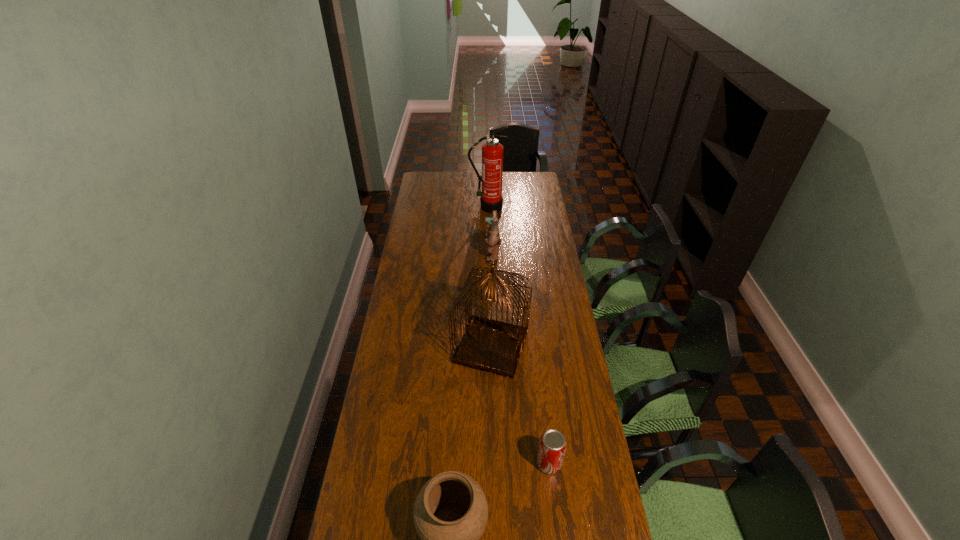
Locate an element on the screen. The image size is (960, 540). fire extinguisher is located at coordinates (491, 199).

Locate an element on the screen. birdcage is located at coordinates (493, 346).

Where is `the fourth nearest object`? This screenshot has height=540, width=960. the fourth nearest object is located at coordinates (493, 242).

Locate an element on the screen. The image size is (960, 540). figurine is located at coordinates pyautogui.click(x=493, y=242).

Identify the location of the second nearest object. (552, 446).

Find the location of `soda can`. soda can is located at coordinates (552, 446).

Identify the location of free region located 0.380m on the front-facing side of the fire extinguisher. (489, 259).

Locate an element on the screen. vacant region located on the left of the birdcage is located at coordinates (419, 347).

At what (x,y) coordinates should I click in order to perform the action: click on vacant space situated 0.180m on the front-facing side of the figurine. Please return your answer as a coordinate pair (x, y). This screenshot has height=540, width=960. Looking at the image, I should click on (446, 256).

At what (x,y) coordinates should I click in order to perform the action: click on vacant space situated on the front-facing side of the figurine. Please return your answer as a coordinate pair (x, y). Looking at the image, I should click on (415, 256).